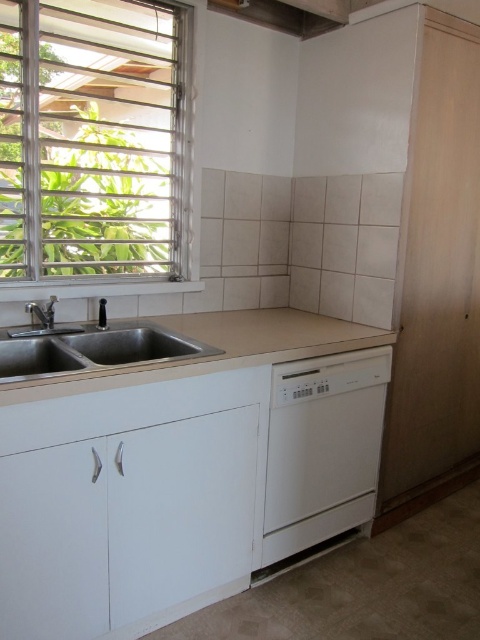
You are a kitchen designer planning to place a new appliance on the beige laminate countertop at center and the brushed metal faucet at left. Which object has more space available for placing items?

The beige laminate countertop at center has more space available for placing items since it is larger in size than the brushed metal faucet at left.